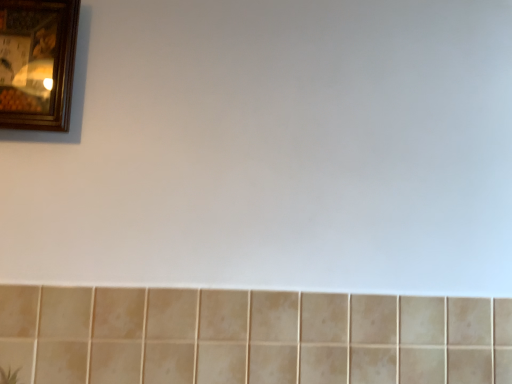
In order to face beige matte tile at lower center, should I rotate leftwards or rightwards?

You should rotate right by 2.230 degrees.

You are a GUI agent. You are given a task and a screenshot of the screen. Output one action in this format:
    pyautogui.click(x=<x>, y=<y>)
    Task: Click on the beige matte tile at lower center
    The height and width of the screenshot is (384, 512).
    Given the screenshot: What is the action you would take?
    pyautogui.click(x=250, y=337)

The width and height of the screenshot is (512, 384). Describe the element at coordinates (250, 337) in the screenshot. I see `beige matte tile at lower center` at that location.

Measure the distance between point (204, 330) and camera.

The depth of point (204, 330) is 33.50 inches.

Where is `wooden picture frame at upper left`? wooden picture frame at upper left is located at coordinates click(x=39, y=59).

The width and height of the screenshot is (512, 384). Describe the element at coordinates (39, 59) in the screenshot. I see `wooden picture frame at upper left` at that location.

What is the approximate height of wooden picture frame at upper left?

The height of wooden picture frame at upper left is 12.02 inches.

The image size is (512, 384). I want to click on beige matte tile at lower center, so click(250, 337).

Can you confirm if wooden picture frame at upper left is positioned to the left of beige matte tile at lower center?

Indeed, wooden picture frame at upper left is positioned on the left side of beige matte tile at lower center.

Is wooden picture frame at upper left positioned behind beige matte tile at lower center?

Yes, wooden picture frame at upper left is behind beige matte tile at lower center.

Does point (46, 37) come behind point (393, 328)?

No, (46, 37) is in front of (393, 328).

Consider the image. From the image's perspective, which object appears higher, wooden picture frame at upper left or beige matte tile at lower center?

wooden picture frame at upper left.

From a real-world perspective, is wooden picture frame at upper left on top of beige matte tile at lower center?

Yes, from a real-world perspective, wooden picture frame at upper left is on top of beige matte tile at lower center.

Considering the relative sizes of wooden picture frame at upper left and beige matte tile at lower center in the image provided, is wooden picture frame at upper left thinner than beige matte tile at lower center?

In fact, wooden picture frame at upper left might be wider than beige matte tile at lower center.

Who is taller, wooden picture frame at upper left or beige matte tile at lower center?

wooden picture frame at upper left is taller.

Is wooden picture frame at upper left smaller than beige matte tile at lower center?

Correct, wooden picture frame at upper left occupies less space than beige matte tile at lower center.

Is wooden picture frame at upper left completely or partially outside of beige matte tile at lower center?

Yes, wooden picture frame at upper left is outside of beige matte tile at lower center.

Are wooden picture frame at upper left and beige matte tile at lower center far apart?

No, wooden picture frame at upper left is not far from beige matte tile at lower center.

Is wooden picture frame at upper left facing towards beige matte tile at lower center?

No.

How many degrees apart are the facing directions of wooden picture frame at upper left and beige matte tile at lower center?

The facing directions of wooden picture frame at upper left and beige matte tile at lower center are 0.367 degrees apart.

The width and height of the screenshot is (512, 384). In order to click on picture frame behind the beige matte tile at lower center in this screenshot , I will do `click(39, 59)`.

Which object is positioned more to the left, beige matte tile at lower center or wooden picture frame at upper left?

wooden picture frame at upper left.

From the picture: Which object is more forward, beige matte tile at lower center or wooden picture frame at upper left?

beige matte tile at lower center.

Which point is more distant from viewer, [87,352] or [70,17]?

The point [70,17] is more distant.

From the image's perspective, is beige matte tile at lower center above or below wooden picture frame at upper left?

beige matte tile at lower center is situated lower than wooden picture frame at upper left in the image.

From a real-world perspective, is beige matte tile at lower center located higher than wooden picture frame at upper left?

No, from a real-world perspective, beige matte tile at lower center is not over wooden picture frame at upper left

Considering the sizes of objects beige matte tile at lower center and wooden picture frame at upper left in the image provided, who is thinner, beige matte tile at lower center or wooden picture frame at upper left?

Thinner between the two is beige matte tile at lower center.

Is beige matte tile at lower center shorter than wooden picture frame at upper left?

Yes.

Considering the relative sizes of beige matte tile at lower center and wooden picture frame at upper left in the image provided, is beige matte tile at lower center smaller than wooden picture frame at upper left?

Incorrect, beige matte tile at lower center is not smaller in size than wooden picture frame at upper left.

Based on the photo, is beige matte tile at lower center spatially inside wooden picture frame at upper left, or outside of it?

The correct answer is: outside.

Are beige matte tile at lower center and wooden picture frame at upper left beside each other?

beige matte tile at lower center is not next to wooden picture frame at upper left, and they're not touching.

Is beige matte tile at lower center oriented towards wooden picture frame at upper left?

No, beige matte tile at lower center does not turn towards wooden picture frame at upper left.

Based on the photo, how different are the orientations of beige matte tile at lower center and wooden picture frame at upper left in degrees?

0.367 degrees separate the facing orientations of beige matte tile at lower center and wooden picture frame at upper left.

Measure the distance between beige matte tile at lower center and wooden picture frame at upper left.

A distance of 21.11 inches exists between beige matte tile at lower center and wooden picture frame at upper left.

Locate an element on the screen. The image size is (512, 384). ceramic tile located below the wooden picture frame at upper left (from the image's perspective) is located at coordinates (250, 337).

At what (x,y) coordinates should I click in order to perform the action: click on picture frame behind the beige matte tile at lower center. Please return your answer as a coordinate pair (x, y). This screenshot has height=384, width=512. Looking at the image, I should click on (39, 59).

Image resolution: width=512 pixels, height=384 pixels. I want to click on picture frame on the left of the beige matte tile at lower center, so click(x=39, y=59).